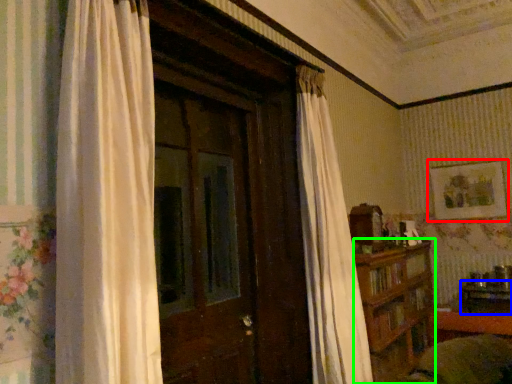
Question: Which object is the closest to the picture frame (highlighted by a red box)? Choose among these: table (highlighted by a blue box) or furniture (highlighted by a green box).

Choices:
 (A) table
 (B) furniture

Answer: (A)